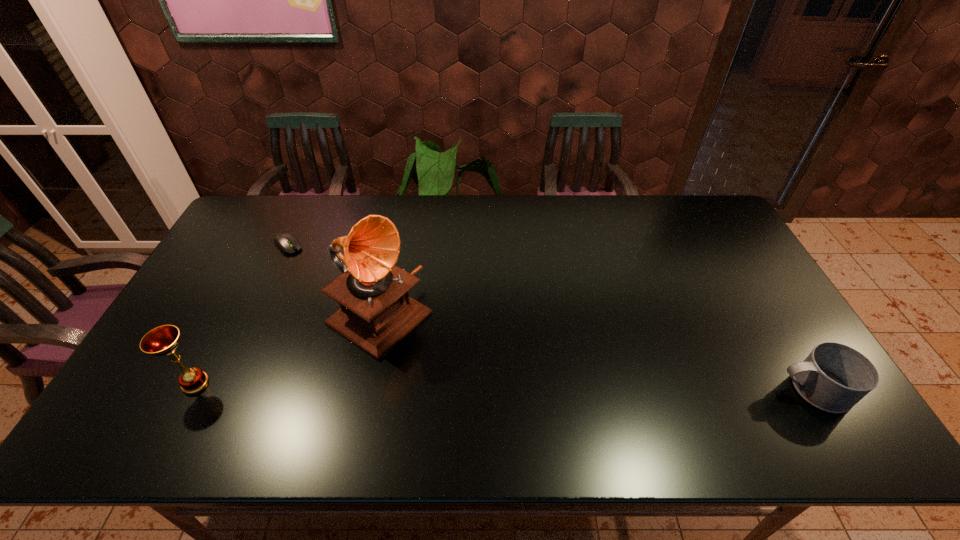
This screenshot has width=960, height=540. In order to click on vacant space that's between the third shortest object and the second farthest object in this screenshot , I will do `click(287, 350)`.

Identify the location of vacant area that lies between the second shortest object and the phonograph record. The image size is (960, 540). (595, 353).

At what (x,y) coordinates should I click in order to perform the action: click on free space between the farthest object and the third tallest object. Please return your answer as a coordinate pair (x, y). Looking at the image, I should click on (550, 318).

Locate an element on the screen. The width and height of the screenshot is (960, 540). vacant area between the rightmost object and the farthest object is located at coordinates (550, 318).

Locate an element on the screen. Image resolution: width=960 pixels, height=540 pixels. free space between the second object from right to left and the second tallest object is located at coordinates tap(287, 350).

At what (x,y) coordinates should I click in order to perform the action: click on free space between the rightmost object and the second object from right to left. Please return your answer as a coordinate pair (x, y). This screenshot has width=960, height=540. Looking at the image, I should click on (595, 353).

The image size is (960, 540). I want to click on empty space that is in between the mug and the chalice, so (504, 386).

At what (x,y) coordinates should I click in order to perform the action: click on vacant area between the second tallest object and the tallest object. Please return your answer as a coordinate pair (x, y). Looking at the image, I should click on (287, 350).

Choose which object is the nearest neighbor to the third shortest object. Please provide its 2D coordinates. Your answer should be formatted as a tuple, i.e. [(x, y)], where the tuple contains the x and y coordinates of a point satisfying the conditions above.

[(376, 313)]

Identify which object is located as the second nearest to the chalice. Please provide its 2D coordinates. Your answer should be formatted as a tuple, i.e. [(x, y)], where the tuple contains the x and y coordinates of a point satisfying the conditions above.

[(285, 242)]